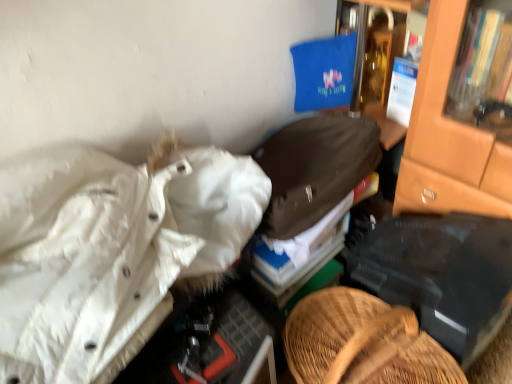
Question: Is white puffy jacket at left, acting as the 1th clothing starting from the bottom, bigger or smaller than brown fabric jacket at center, the 1th clothing when ordered from top to bottom?

Choices:
 (A) small
 (B) big

Answer: (B)

Question: From the image's perspective, is white puffy jacket at left, acting as the 1th clothing starting from the bottom, positioned above or below brown fabric jacket at center, placed as the second clothing when sorted from bottom to top?

Choices:
 (A) below
 (B) above

Answer: (A)

Question: Looking at their shapes, would you say white puffy jacket at left, acting as the 1th clothing starting from the bottom, is wider or thinner than brown fabric jacket at center, the 1th clothing when ordered from top to bottom?

Choices:
 (A) wide
 (B) thin

Answer: (A)

Question: From the image's perspective, is brown fabric jacket at center, placed as the second clothing when sorted from bottom to top, located above or below white puffy jacket at left, placed as the 2th clothing when sorted from top to bottom?

Choices:
 (A) above
 (B) below

Answer: (A)

Question: In terms of width, does brown fabric jacket at center, the 1th clothing when ordered from top to bottom, look wider or thinner when compared to white puffy jacket at left, acting as the 1th clothing starting from the bottom?

Choices:
 (A) thin
 (B) wide

Answer: (A)

Question: Does point (271, 172) appear closer or farther from the camera than point (34, 292)?

Choices:
 (A) closer
 (B) farther

Answer: (B)

Question: Is brown fabric jacket at center, placed as the second clothing when sorted from bottom to top, taller or shorter than white puffy jacket at left, acting as the 1th clothing starting from the bottom?

Choices:
 (A) tall
 (B) short

Answer: (B)